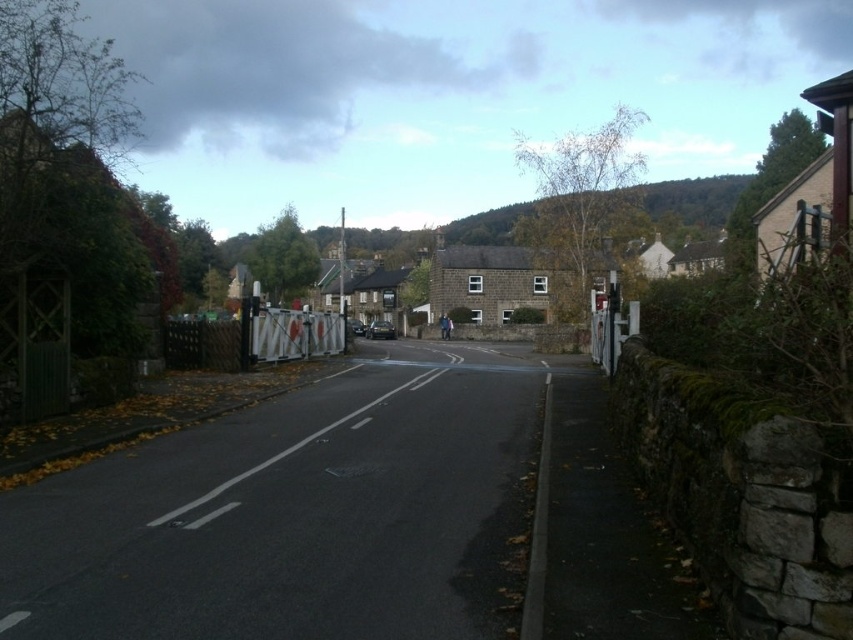
Question: Is brown stone house at center smaller than white plastic barrier at center?

Choices:
 (A) no
 (B) yes

Answer: (A)

Question: Which point is closer to the camera taking this photo?

Choices:
 (A) tap(163, 339)
 (B) tap(345, 288)

Answer: (A)

Question: Is white plastic barrier at center to the right of stone house at center from the viewer's perspective?

Choices:
 (A) yes
 (B) no

Answer: (B)

Question: Among these points, which one is nearest to the camera?

Choices:
 (A) (763, 241)
 (B) (328, 269)
 (C) (299, 339)

Answer: (C)

Question: Is white plastic barrier at center in front of stone house at center?

Choices:
 (A) no
 (B) yes

Answer: (A)

Question: Which point is farther to the camera?

Choices:
 (A) brown stone house at center
 (B) white plastic barrier at center
 (C) stone house at center

Answer: (A)